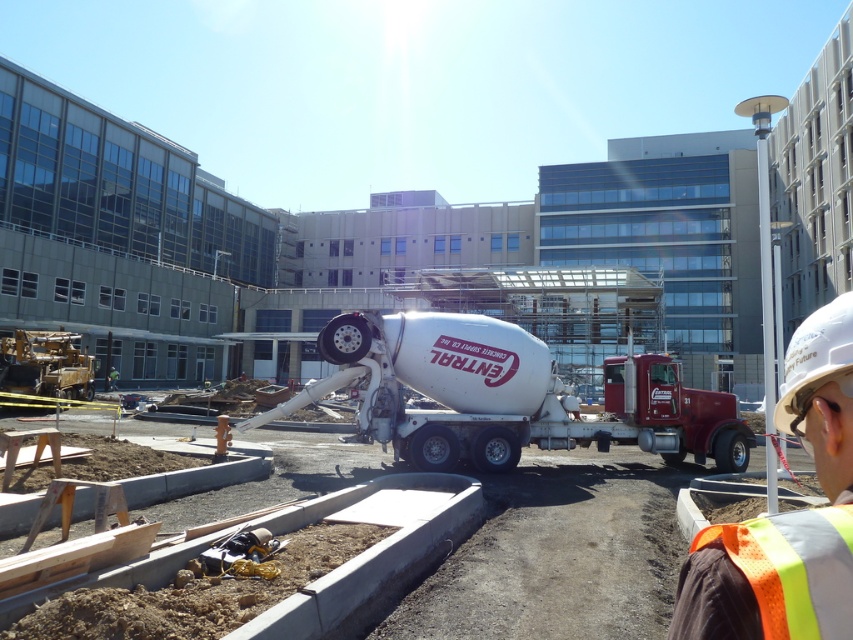
Which is above, white metallic concrete mixer at center or white hard hat at upper right?

Positioned higher is white hard hat at upper right.

Based on the photo, is white metallic concrete mixer at center shorter than white hard hat at upper right?

In fact, white metallic concrete mixer at center may be taller than white hard hat at upper right.

Image resolution: width=853 pixels, height=640 pixels. Describe the element at coordinates (506, 396) in the screenshot. I see `white metallic concrete mixer at center` at that location.

At what (x,y) coordinates should I click in order to perform the action: click on white metallic concrete mixer at center. Please return your answer as a coordinate pair (x, y). Image resolution: width=853 pixels, height=640 pixels. Looking at the image, I should click on (506, 396).

Is white metallic concrete mixer at center shorter than orange reflective vest at lower right?

In fact, white metallic concrete mixer at center may be taller than orange reflective vest at lower right.

Is point (746, 444) farther from viewer compared to point (836, 406)?

Yes.

This screenshot has width=853, height=640. Identify the location of white metallic concrete mixer at center. (506, 396).

Does white metallic concrete mixer at center have a smaller size compared to hi-visibility reflective safety vest at lower right?

No.

Measure the distance between point (x=518, y=428) and camera.

Point (x=518, y=428) is 42.03 feet from camera.

Find the location of a particular element. white metallic concrete mixer at center is located at coordinates (506, 396).